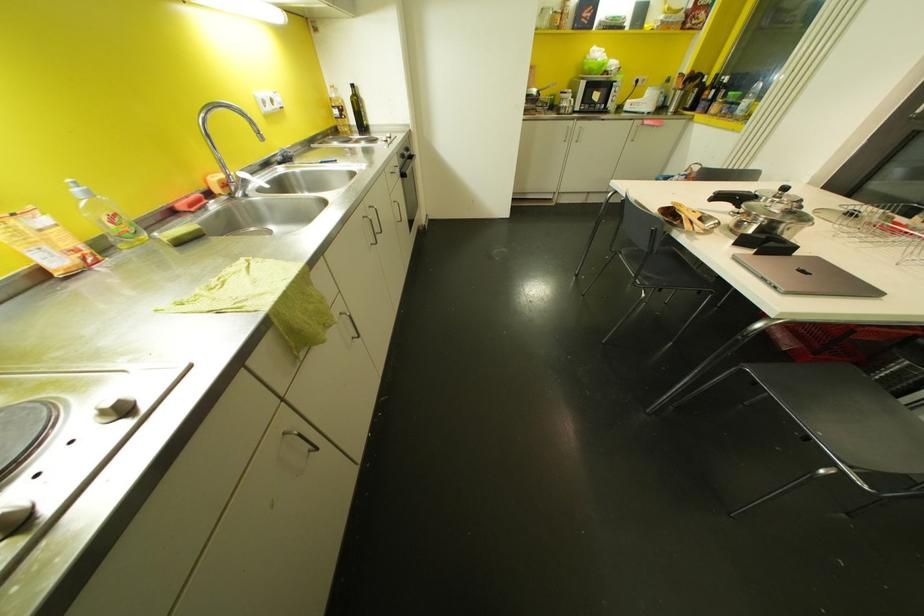
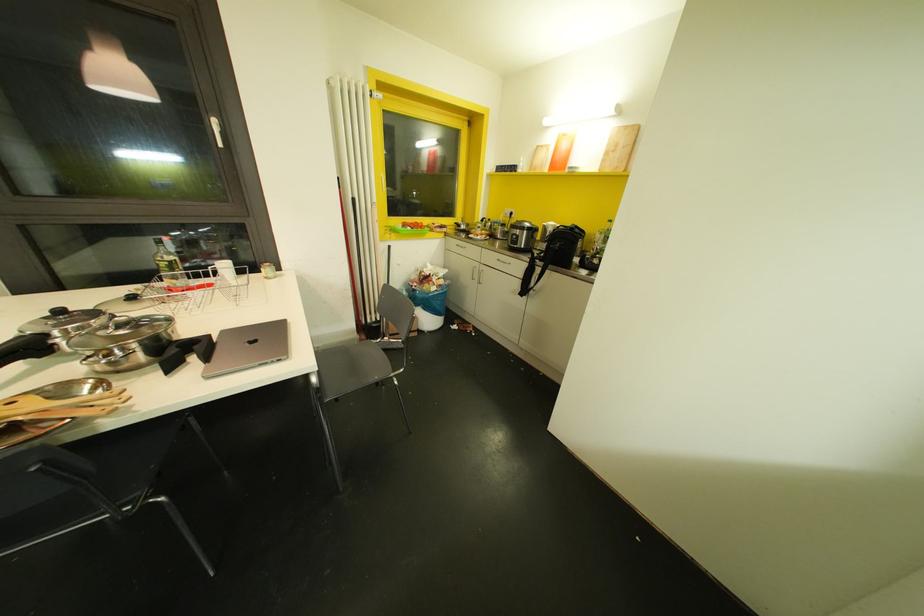
Find the pixel in the second image that matches (686,225) in the first image.

(82, 413)